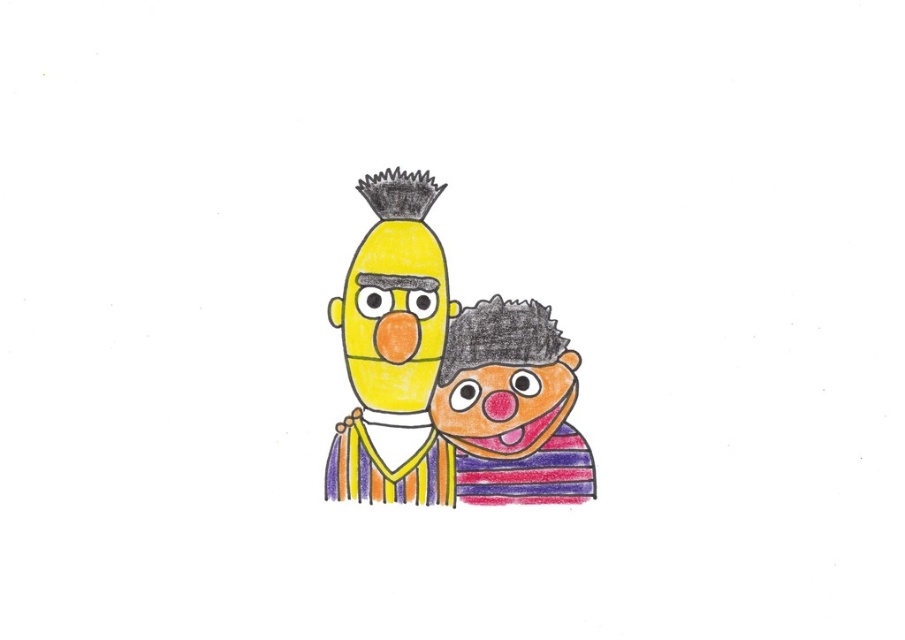
Question: Which object is closer to the camera taking this photo?

Choices:
 (A) matte red nose at center
 (B) matte yellow head at center
 (C) yellow matte face at center

Answer: (B)

Question: Does matte yellow head at center appear under yellow matte face at center?

Choices:
 (A) yes
 (B) no

Answer: (A)

Question: Can you confirm if matte yellow head at center is positioned below smooth striped sweater at right?

Choices:
 (A) no
 (B) yes

Answer: (A)

Question: Which object is the farthest from the yellow matte face at center?

Choices:
 (A) striped fabric face at right
 (B) matte red nose at center
 (C) smooth striped sweater at right
 (D) matte yellow head at center

Answer: (B)

Question: Which point is closer to the camera taking this photo?

Choices:
 (A) (538, 417)
 (B) (405, 326)
 (C) (530, 349)
 (D) (503, 420)

Answer: (A)

Question: In this image, where is matte yellow head at center located relative to matte red nose at center?

Choices:
 (A) below
 (B) above

Answer: (B)